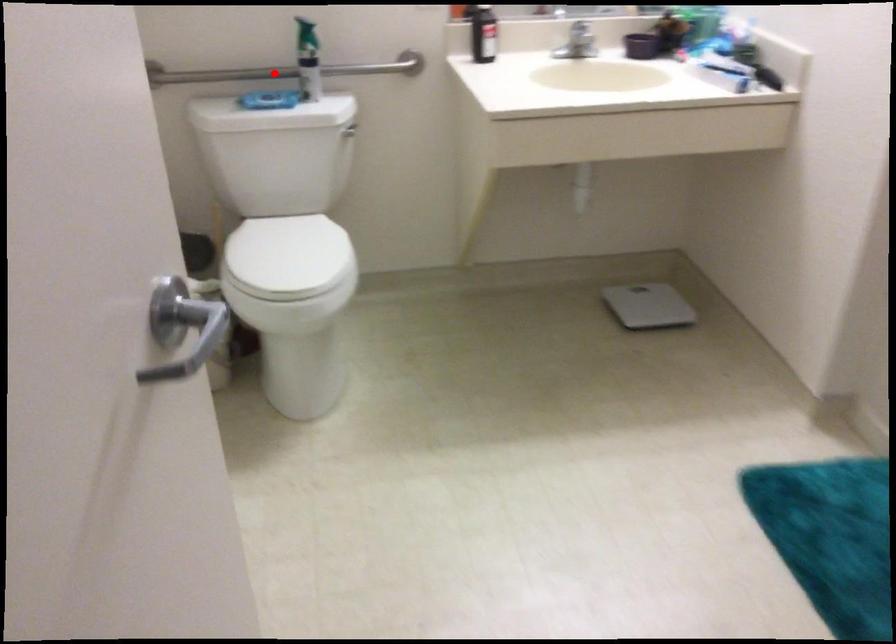
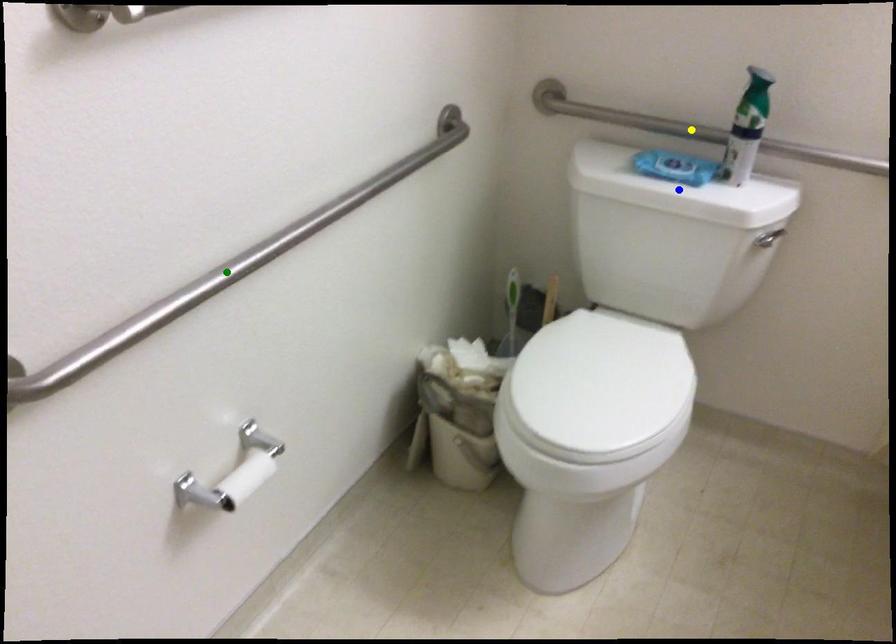
Question: I am providing you with two images of the same scene from different viewpoints. A red point is marked on the first image. You are given multiple points on the second image. Which point in image 2 represents the same 3d spot as the red point in image 1?

Choices:
 (A) green point
 (B) yellow point
 (C) blue point

Answer: (B)